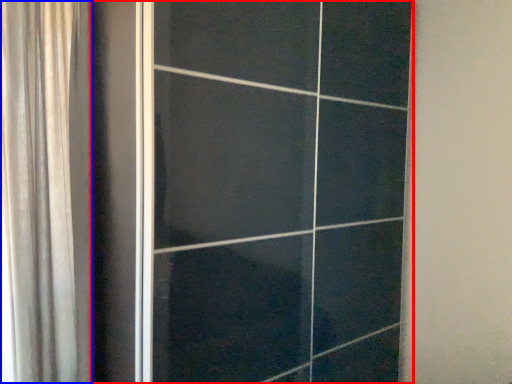
Question: Which point is further to the camera, door (highlighted by a red box) or curtain (highlighted by a blue box)?

Choices:
 (A) door
 (B) curtain

Answer: (B)